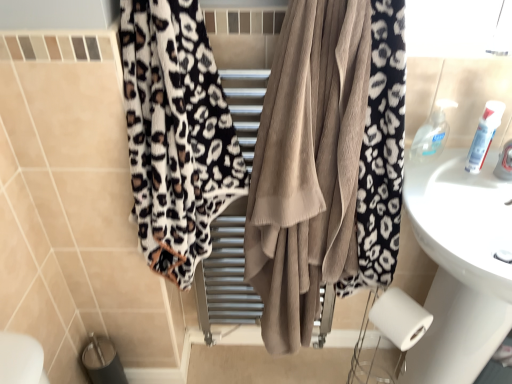
Question: Is leopard print towel at center, which is the first curtain in right-to-left order, bigger or smaller than white glossy tube at upper right, the 1th toiletry positioned from the right?

Choices:
 (A) big
 (B) small

Answer: (A)

Question: Is leopard print towel at center, the 2th curtain viewed from the left, in front of or behind white glossy tube at upper right, which appears as the 2th toiletry when viewed from the left, in the image?

Choices:
 (A) front
 (B) behind

Answer: (A)

Question: Which is farther from the white glossy tube at upper right, the 1th toiletry positioned from the right?

Choices:
 (A) leopard print towel at center, which is the first curtain in right-to-left order
 (B) clear plastic soap dispenser at upper right, the second toiletry when ordered from right to left
 (C) leopard print fabric at left, which appears as the first curtain when viewed from the left

Answer: (C)

Question: Which of these objects is positioned farthest from the leopard print fabric at left, positioned as the second curtain in right-to-left order?

Choices:
 (A) white glossy tube at upper right, which appears as the 2th toiletry when viewed from the left
 (B) clear plastic soap dispenser at upper right, the first toiletry viewed from the left
 (C) leopard print towel at center, which is the first curtain in right-to-left order

Answer: (A)